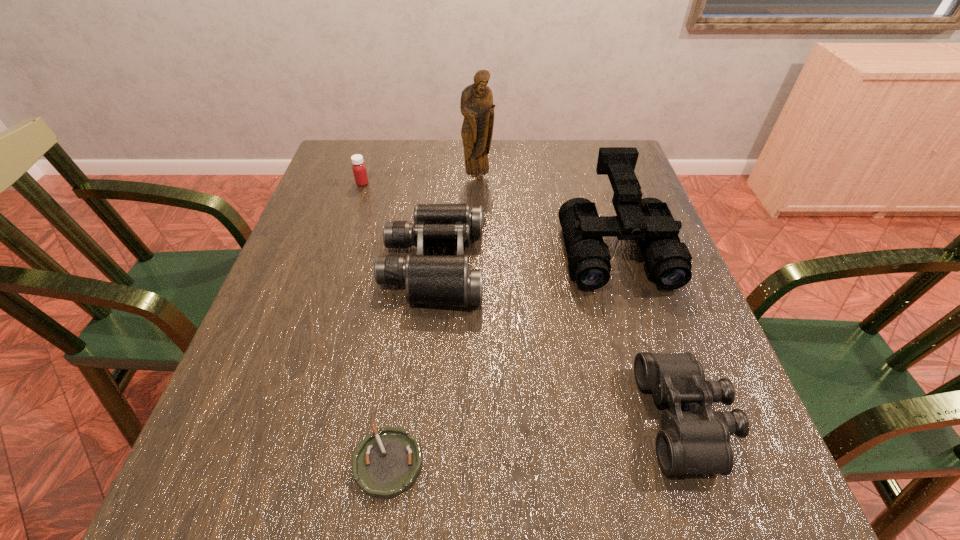
You are a GUI agent. You are given a task and a screenshot of the screen. Output one action in this format:
    pyautogui.click(x=<x>, y=<y>)
    Task: Click on the tallest object
    
    Given the screenshot: What is the action you would take?
    pyautogui.click(x=477, y=107)

The height and width of the screenshot is (540, 960). In order to click on the tallest binoculars in this screenshot , I will do click(649, 221).

Locate an element on the screen. Image resolution: width=960 pixels, height=540 pixels. the leftmost binoculars is located at coordinates [445, 280].

Image resolution: width=960 pixels, height=540 pixels. I want to click on the third tallest object, so click(445, 280).

Locate an element on the screen. This screenshot has height=540, width=960. the leftmost object is located at coordinates (359, 169).

Identify the location of the shortest binoculars. (698, 442).

Where is `ashtray`? ashtray is located at coordinates (386, 463).

Identify the location of vacant space positioned 0.380m on the front-facing side of the figurine. This screenshot has width=960, height=540. (x=477, y=282).

I want to click on free space located 0.110m on the front lenses of the fifth shortest object, so click(x=642, y=335).

Where is `vacant position located 0.110m on the front-facing side of the second tallest binoculars`? The image size is (960, 540). vacant position located 0.110m on the front-facing side of the second tallest binoculars is located at coordinates click(531, 265).